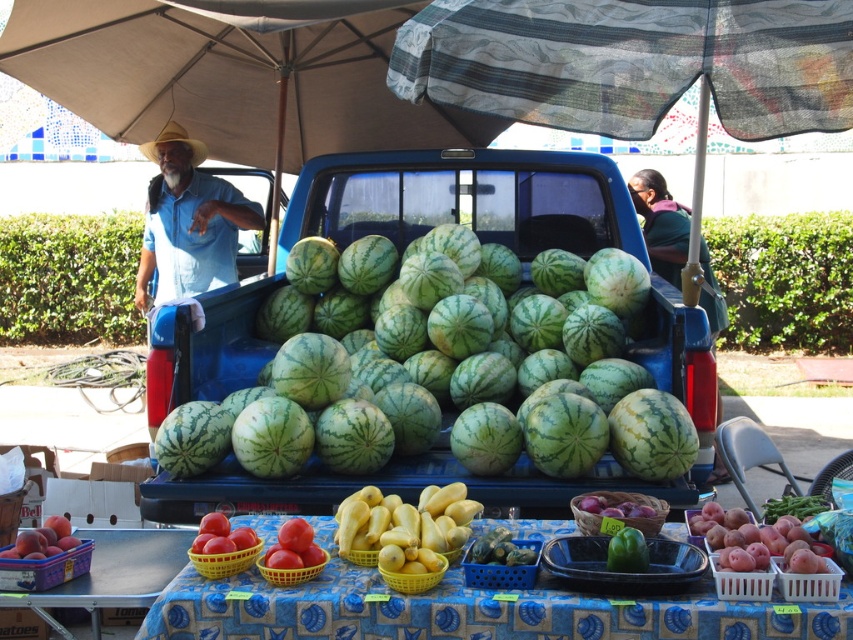
Question: In this image, where is beige fabric umbrella at upper center located relative to green matte bell pepper at center?

Choices:
 (A) left
 (B) right

Answer: (A)

Question: Which of these objects is positioned farthest from the smooth plastic table at center?

Choices:
 (A) matte plastic basket of tomatoes at lower left
 (B) smooth red potatoes at lower right

Answer: (A)

Question: Is light blue denim shirt at left below matte plastic basket of tomatoes at lower left?

Choices:
 (A) yes
 (B) no

Answer: (B)

Question: Is smooth red potatoes at lower right thinner than smooth red tomato at lower left?

Choices:
 (A) yes
 (B) no

Answer: (B)

Question: Which point is closer to the camera?

Choices:
 (A) (321, 152)
 (B) (645, 547)
 (C) (392, 445)
 (D) (144, 568)

Answer: (B)

Question: Which object is farther from the camera taking this photo?

Choices:
 (A) smooth red potatoes at lower right
 (B) beige fabric umbrella at upper center
 (C) green matte bell pepper at center
 (D) smooth plastic table at center

Answer: (B)